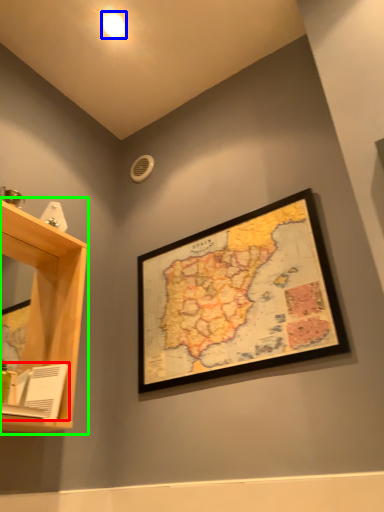
Question: Estimate the real-world distances between objects in this image. Which object is closer to book (highlighted by a red box), light (highlighted by a blue box) or shelf (highlighted by a green box)?

Choices:
 (A) light
 (B) shelf

Answer: (B)